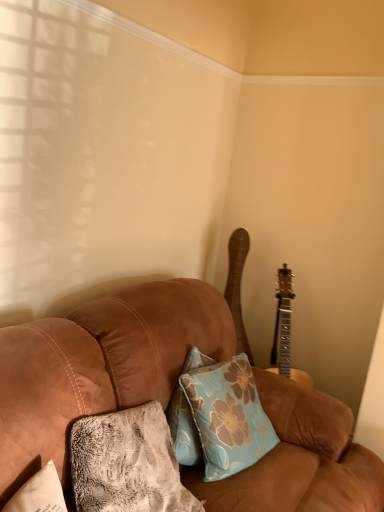
Where is `fuzzy gray pillow at lower left`? This screenshot has height=512, width=384. fuzzy gray pillow at lower left is located at coordinates (127, 463).

Image resolution: width=384 pixels, height=512 pixels. Describe the element at coordinates (127, 463) in the screenshot. I see `fuzzy gray pillow at lower left` at that location.

The height and width of the screenshot is (512, 384). In order to click on fuzzy gray pillow at lower left in this screenshot , I will do `click(127, 463)`.